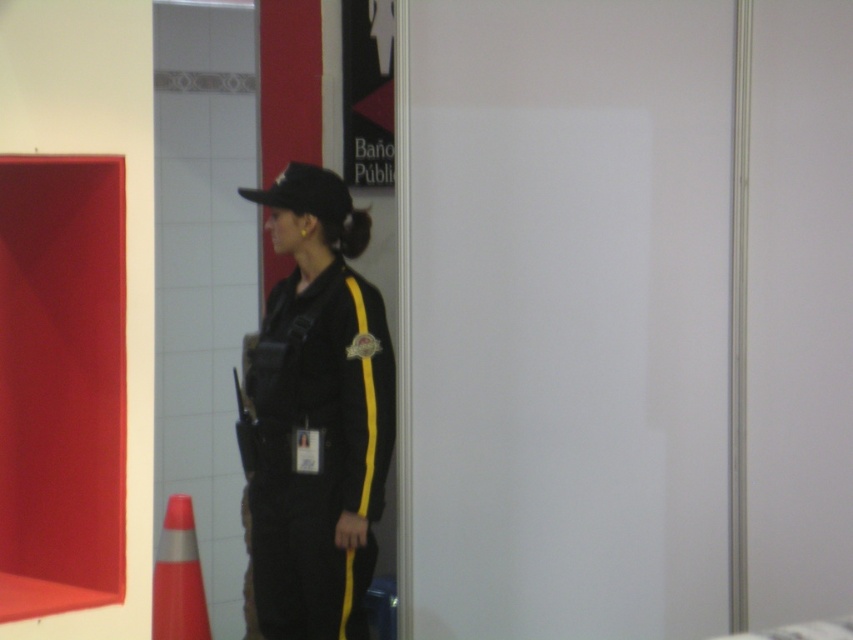
You are a security officer trying to locate your colleague who is wearing the black matte uniform at center. According to the coordinates provided, where exactly is your colleague positioned in the image?

The black matte uniform at center is located at point [317,413], so your colleague is positioned at those coordinates in the image.

You are a delivery driver who needs to park your vehicle near the orange reflective cone at lower left. The parking spot has a height restriction of 6 feet. Can you determine if the black matte uniform at center worn by the person would exceed this height limit when parked?

The black matte uniform at center is above the orange reflective cone at lower left, but the exact height of the uniform is not provided. Therefore, it is impossible to determine if it exceeds the 6 feet height restriction without additional information.

You are a delivery person who needs to place a package in a secure location near the orange reflective cone at lower left. The black matte uniform at center is an employee. Can you ask them for help?

The black matte uniform at center is positioned on the right side of the orange reflective cone at lower left, so you can approach them for assistance as they are nearby.